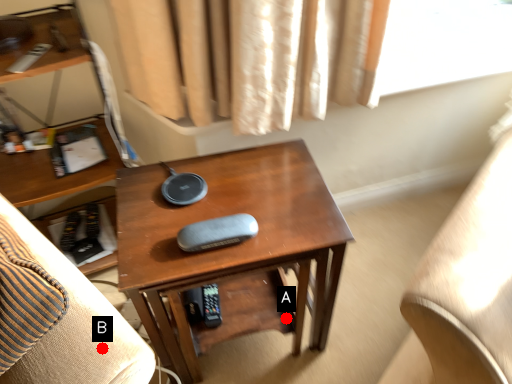
Question: Two points are circled on the image, labeled by A and B beside each circle. Which of the following is the closest to the observer?

Choices:
 (A) A is closer
 (B) B is closer

Answer: (B)